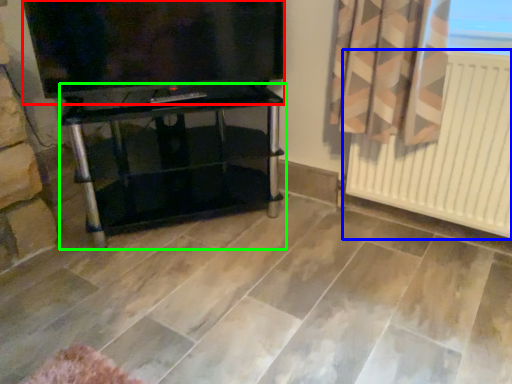
Question: Estimate the real-world distances between objects in this image. Which object is farther from television (highlighted by a red box), radiator (highlighted by a blue box) or furniture (highlighted by a green box)?

Choices:
 (A) radiator
 (B) furniture

Answer: (A)